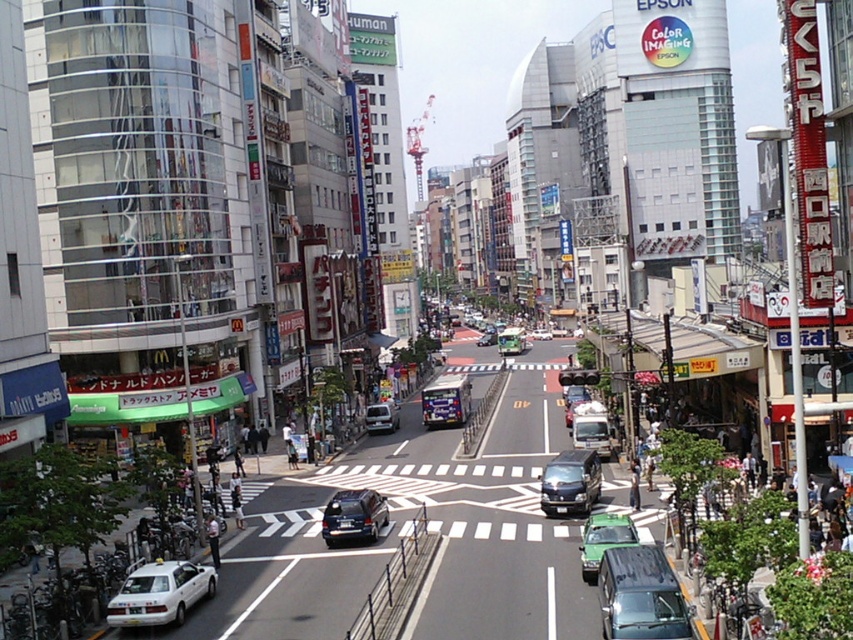
Question: Estimate the real-world distances between objects in this image. Which object is closer to the shiny black sedan at center?

Choices:
 (A) white matte taxi at lower left
 (B) shiny black van at center

Answer: (A)

Question: Which object appears closest to the camera in this image?

Choices:
 (A) shiny black van at center
 (B) green matte car at center
 (C) shiny black sedan at center

Answer: (B)

Question: Can you confirm if shiny black sedan at center is wider than matte silver van at center?

Choices:
 (A) no
 (B) yes

Answer: (A)

Question: Is shiny black van at center wider than matte silver van at center?

Choices:
 (A) yes
 (B) no

Answer: (A)

Question: Is green matte van at center smaller than green matte car at center?

Choices:
 (A) yes
 (B) no

Answer: (B)

Question: Which point is farther to the camera?

Choices:
 (A) (595, 518)
 (B) (131, 600)
 (C) (595, 486)
 (D) (646, 556)

Answer: (C)